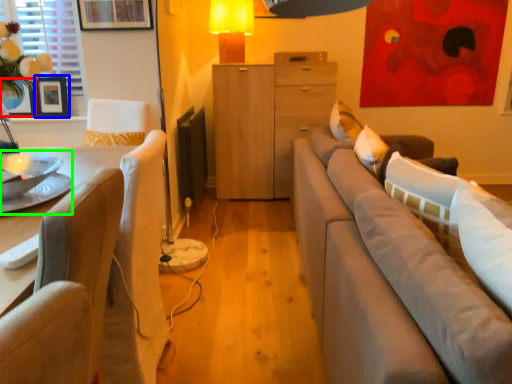
Question: Which object is the closest to the vase (highlighted by a red box)? Choose among these: picture frame (highlighted by a blue box) or round table (highlighted by a green box).

Choices:
 (A) picture frame
 (B) round table

Answer: (A)